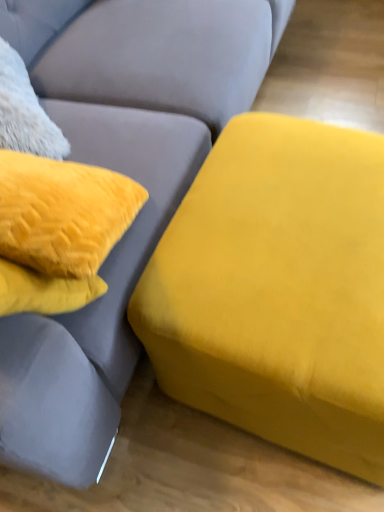
Question: Should I look upward or downward to see velvet yellow ottoman at right, marked as the 2th studio couch in a bottom-to-top arrangement?

Choices:
 (A) up
 (B) down

Answer: (A)

Question: Can you confirm if velvet yellow ottoman at right, which is the 2th studio couch in top-to-bottom order, is positioned to the right of velvet yellow ottoman at right, placed as the 1th studio couch when sorted from top to bottom?

Choices:
 (A) yes
 (B) no

Answer: (A)

Question: Can you confirm if velvet yellow ottoman at right, positioned as the 1th studio couch in bottom-to-top order, is wider than velvet yellow ottoman at right, placed as the 1th studio couch when sorted from top to bottom?

Choices:
 (A) yes
 (B) no

Answer: (B)

Question: Does velvet yellow ottoman at right, which is the 2th studio couch in top-to-bottom order, have a larger size compared to velvet yellow ottoman at right, placed as the 1th studio couch when sorted from top to bottom?

Choices:
 (A) yes
 (B) no

Answer: (B)

Question: Does velvet yellow ottoman at right, which is the 2th studio couch in top-to-bottom order, lie in front of velvet yellow ottoman at right, placed as the 1th studio couch when sorted from top to bottom?

Choices:
 (A) yes
 (B) no

Answer: (B)

Question: Would you say velvet yellow ottoman at right, placed as the 1th studio couch when sorted from top to bottom, is part of velvet yellow ottoman at right, positioned as the 1th studio couch in bottom-to-top order,'s contents?

Choices:
 (A) no
 (B) yes

Answer: (A)

Question: Does velvet yellow ottoman at right, positioned as the 1th studio couch in bottom-to-top order, have a lesser width compared to velvet yellow ottoman at right, marked as the 2th studio couch in a bottom-to-top arrangement?

Choices:
 (A) yes
 (B) no

Answer: (A)

Question: Does velvet yellow ottoman at right, marked as the 2th studio couch in a bottom-to-top arrangement, turn towards velvet yellow ottoman at right, positioned as the 1th studio couch in bottom-to-top order?

Choices:
 (A) yes
 (B) no

Answer: (A)

Question: Is velvet yellow ottoman at right, placed as the 1th studio couch when sorted from top to bottom, looking in the opposite direction of velvet yellow ottoman at right, positioned as the 1th studio couch in bottom-to-top order?

Choices:
 (A) yes
 (B) no

Answer: (B)

Question: Is velvet yellow ottoman at right, placed as the 1th studio couch when sorted from top to bottom, at the left side of velvet yellow ottoman at right, positioned as the 1th studio couch in bottom-to-top order?

Choices:
 (A) yes
 (B) no

Answer: (A)

Question: Considering the relative sizes of velvet yellow ottoman at right, placed as the 1th studio couch when sorted from top to bottom, and velvet yellow ottoman at right, positioned as the 1th studio couch in bottom-to-top order, in the image provided, is velvet yellow ottoman at right, placed as the 1th studio couch when sorted from top to bottom, bigger than velvet yellow ottoman at right, positioned as the 1th studio couch in bottom-to-top order,?

Choices:
 (A) no
 (B) yes

Answer: (B)

Question: Can you confirm if velvet yellow ottoman at right, placed as the 1th studio couch when sorted from top to bottom, is thinner than velvet yellow ottoman at right, positioned as the 1th studio couch in bottom-to-top order?

Choices:
 (A) no
 (B) yes

Answer: (A)

Question: Considering the relative positions of velvet yellow ottoman at right, marked as the 2th studio couch in a bottom-to-top arrangement, and velvet yellow ottoman at right, positioned as the 1th studio couch in bottom-to-top order, in the image provided, is velvet yellow ottoman at right, marked as the 2th studio couch in a bottom-to-top arrangement, to the right of velvet yellow ottoman at right, positioned as the 1th studio couch in bottom-to-top order, from the viewer's perspective?

Choices:
 (A) no
 (B) yes

Answer: (A)

Question: From the image's perspective, is velvet yellow ottoman at right, placed as the 1th studio couch when sorted from top to bottom, located above or below velvet yellow ottoman at right, which is the 2th studio couch in top-to-bottom order?

Choices:
 (A) below
 (B) above

Answer: (B)